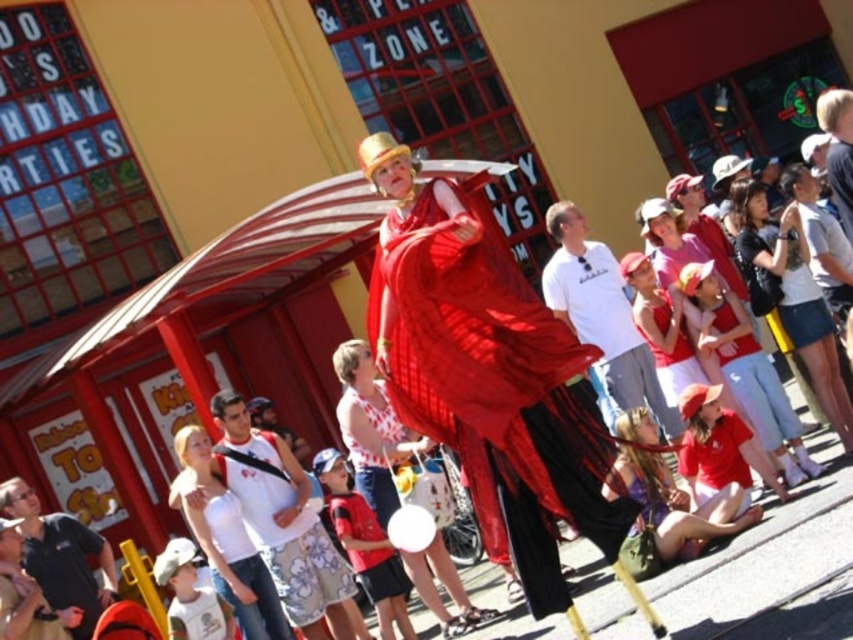
Between point (198, 538) and point (49, 600), which one is positioned in front?

Point (198, 538) is more forward.

The height and width of the screenshot is (640, 853). Describe the element at coordinates (224, 538) in the screenshot. I see `white matte tank top at center` at that location.

Is point (238, 609) farther from camera compared to point (16, 493)?

No, (238, 609) is in front of (16, 493).

The image size is (853, 640). I want to click on white matte tank top at center, so point(224,538).

Consider the image. Between white cotton shirt at center and dark blue shirt at lower left, which one appears on the left side from the viewer's perspective?

dark blue shirt at lower left

Measure the distance from white cotton shirt at center to dark blue shirt at lower left.

white cotton shirt at center is 14.52 meters from dark blue shirt at lower left.

Measure the distance between white cotton shirt at center and camera.

The distance of white cotton shirt at center from camera is 62.49 feet.

Where is `white cotton shirt at center`? white cotton shirt at center is located at coordinates (602, 317).

Which is more to the right, matte red shirt at lower center or dark blue shirt at lower left?

matte red shirt at lower center is more to the right.

Does matte red shirt at lower center have a smaller size compared to dark blue shirt at lower left?

Incorrect, matte red shirt at lower center is not smaller in size than dark blue shirt at lower left.

Who is more distant from viewer, (709, 323) or (50, 580)?

Point (50, 580)

In order to click on matte red shirt at lower center in this screenshot , I will do `click(746, 371)`.